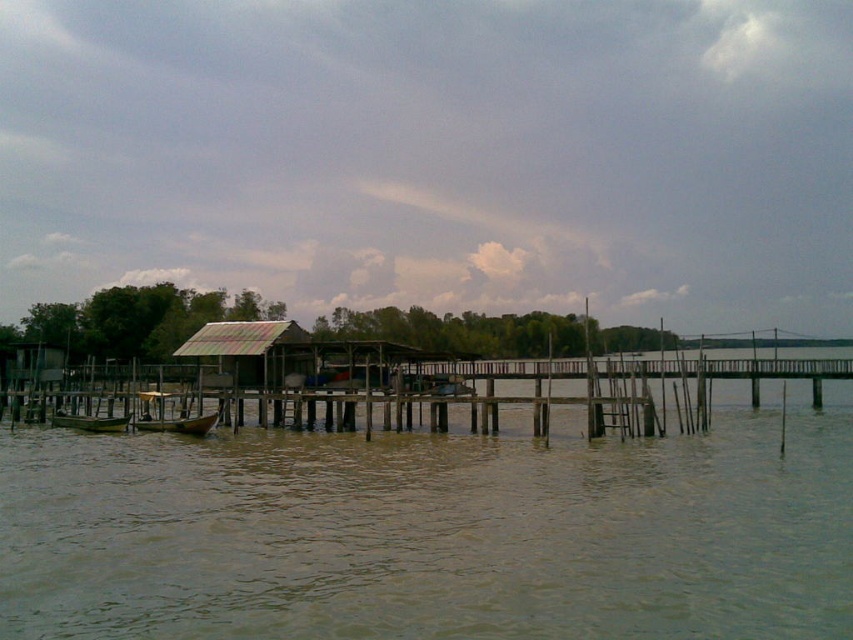
You are standing on the riverside and want to board the wooden boat at center and the green matte boat at lower left. Which boat is closer to the shore?

The wooden boat at center is closer to the shore because it is in front of the green matte boat at lower left, meaning it is positioned between the shore and the other boat.

You are a visitor standing on the riverside and want to take a photo of both the rusty corrugated metal hut at center and the wooden boat at center. Which object should you focus on first if you want to include both in your frame without moving the camera?

The rusty corrugated metal hut at center has a larger size compared to the wooden boat at center, so you should focus on the larger object first to ensure both fit in the frame.

You are a fisherman who needs to board the wooden boat at center. The rusty corrugated metal hut at center is in your way. Can you pass underneath it to reach the boat?

The rusty corrugated metal hut at center is located above the wooden boat at center, so you can pass underneath it to reach the boat.